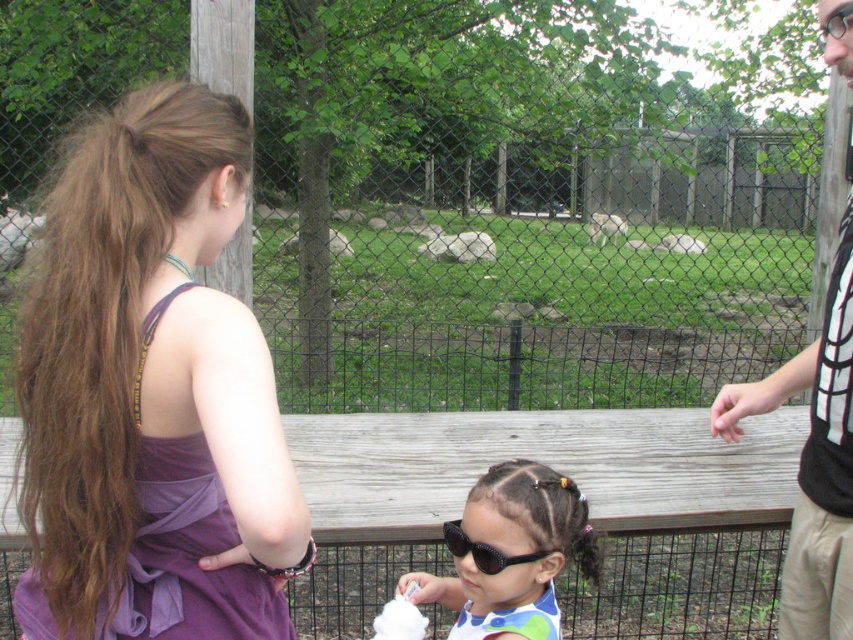
Question: Can you confirm if black and white shirt at upper right is wider than white fur dog at center?

Choices:
 (A) yes
 (B) no

Answer: (B)

Question: Which of the following is the farthest from the observer?

Choices:
 (A) purple fabric dress at left
 (B) gray stone rock at center
 (C) metal mesh fence at center

Answer: (B)

Question: Which object is farther from the camera taking this photo?

Choices:
 (A) gray stone rock at center
 (B) metal mesh fence at center
 (C) black and white shirt at upper right
 (D) black shiny sunglasses at center

Answer: (A)

Question: Which point is closer to the camera?

Choices:
 (A) black and white shirt at upper right
 (B) purple fabric dress at left
 (C) white fur animal at center
 (D) white fur dog at center

Answer: (B)

Question: Is the position of black and white shirt at upper right less distant than that of black plastic sunglasses at center?

Choices:
 (A) yes
 (B) no

Answer: (A)

Question: Observing the image, what is the correct spatial positioning of metal mesh fence at center in reference to white fur dog at center?

Choices:
 (A) below
 (B) above

Answer: (A)